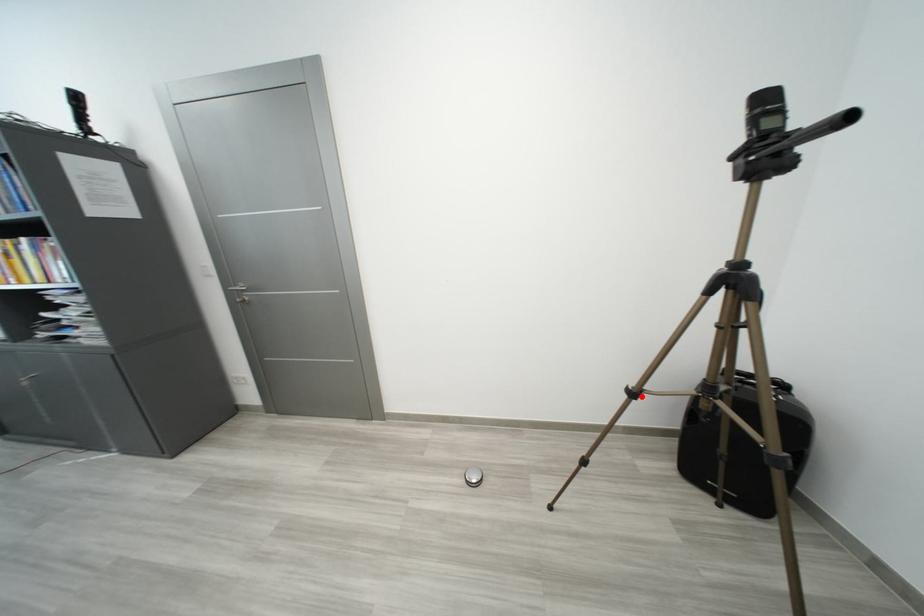
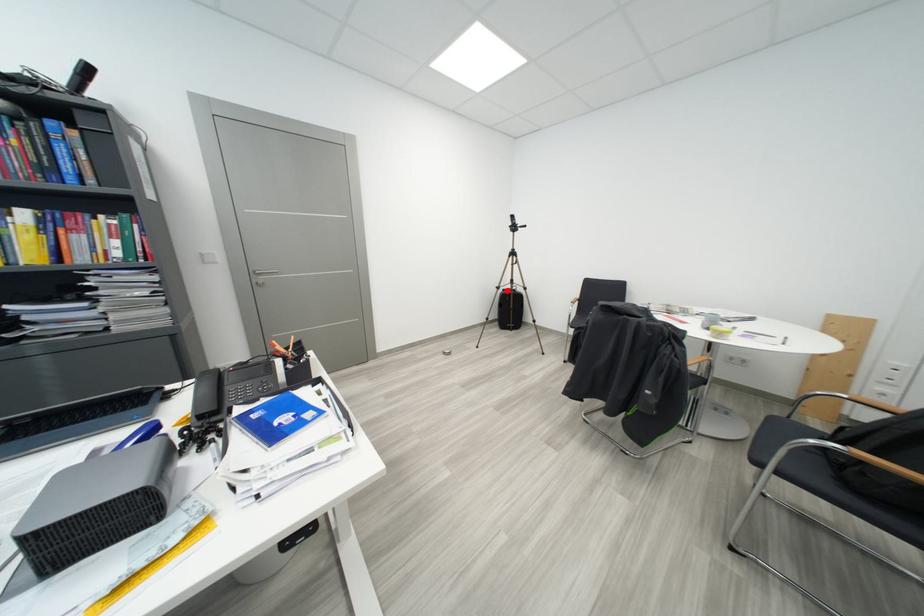
I am providing you with two images of the same scene from different viewpoints. A red point is marked on the first image and another point is marked on the second image. Are the points marked in image1 and image2 representing the same 3D position?

Yes